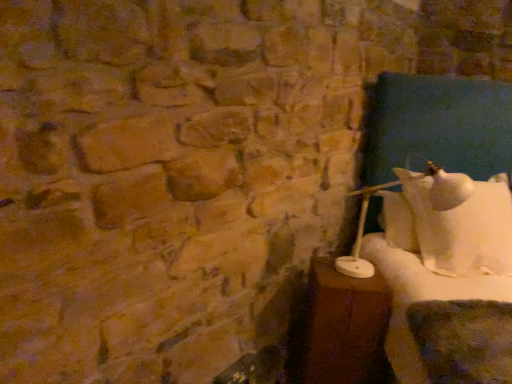
Where is `white matte table lamp at right`? Image resolution: width=512 pixels, height=384 pixels. white matte table lamp at right is located at coordinates (366, 216).

The width and height of the screenshot is (512, 384). What do you see at coordinates (366, 216) in the screenshot?
I see `white matte table lamp at right` at bounding box center [366, 216].

What do you see at coordinates (344, 327) in the screenshot? I see `brown wooden table at right` at bounding box center [344, 327].

You are a GUI agent. You are given a task and a screenshot of the screen. Output one action in this format:
    pyautogui.click(x=<x>, y=<y>)
    Task: Click on the brown wooden table at right
    The height and width of the screenshot is (384, 512).
    Given the screenshot: What is the action you would take?
    pyautogui.click(x=344, y=327)

What is the approximate height of brown wooden table at right?

26.47 inches.

Measure the distance between brown wooden table at right and camera.

They are 6.09 feet apart.

What are the coordinates of `white matte table lamp at right` in the screenshot? It's located at (366, 216).

Considering the positions of objects white matte table lamp at right and brown wooden table at right in the image provided, who is more to the left, white matte table lamp at right or brown wooden table at right?

Positioned to the left is brown wooden table at right.

Is white matte table lamp at right positioned before brown wooden table at right?

Yes, white matte table lamp at right is in front of brown wooden table at right.

Considering the positions of point (364, 262) and point (355, 333), is point (364, 262) closer or farther from the camera than point (355, 333)?

Point (364, 262).

From the image's perspective, is white matte table lamp at right below brown wooden table at right?

No, from the image's perspective, white matte table lamp at right is not beneath brown wooden table at right.

From a real-world perspective, who is located higher, white matte table lamp at right or brown wooden table at right?

white matte table lamp at right.

Considering the sizes of objects white matte table lamp at right and brown wooden table at right in the image provided, who is wider, white matte table lamp at right or brown wooden table at right?

Wider between the two is white matte table lamp at right.

Is white matte table lamp at right taller than brown wooden table at right?

No, white matte table lamp at right is not taller than brown wooden table at right.

Considering the relative sizes of white matte table lamp at right and brown wooden table at right in the image provided, is white matte table lamp at right bigger than brown wooden table at right?

Yes, white matte table lamp at right is bigger than brown wooden table at right.

Can we say white matte table lamp at right lies outside brown wooden table at right?

Yes, white matte table lamp at right is located beyond the bounds of brown wooden table at right.

Are white matte table lamp at right and brown wooden table at right making contact?

No.

Could you tell me if white matte table lamp at right is turned towards brown wooden table at right?

No, white matte table lamp at right does not turn towards brown wooden table at right.

How many degrees apart are the facing directions of white matte table lamp at right and brown wooden table at right?

The facing directions of white matte table lamp at right and brown wooden table at right are 52.4 degrees apart.

The image size is (512, 384). In order to click on furniture that is under the white matte table lamp at right (from a real-world perspective) in this screenshot , I will do `click(344, 327)`.

Considering the relative positions of brown wooden table at right and white matte table lamp at right in the image provided, is brown wooden table at right to the left of white matte table lamp at right from the viewer's perspective?

Yes.

Relative to white matte table lamp at right, is brown wooden table at right in front or behind?

In the image, brown wooden table at right appears behind white matte table lamp at right.

Is point (306, 316) behind point (341, 265)?

Yes, point (306, 316) is behind point (341, 265).

From the image's perspective, which one is positioned lower, brown wooden table at right or white matte table lamp at right?

brown wooden table at right.

From a real-world perspective, who is located lower, brown wooden table at right or white matte table lamp at right?

brown wooden table at right is physically lower.

Between brown wooden table at right and white matte table lamp at right, which one has larger width?

With larger width is white matte table lamp at right.

From the picture: Who is taller, brown wooden table at right or white matte table lamp at right?

Standing taller between the two is brown wooden table at right.

Can you confirm if brown wooden table at right is smaller than white matte table lamp at right?

Indeed, brown wooden table at right has a smaller size compared to white matte table lamp at right.

Could white matte table lamp at right be considered to be inside brown wooden table at right?

No.

Would you say brown wooden table at right is a long distance from white matte table lamp at right?

No, there isn't a large distance between brown wooden table at right and white matte table lamp at right.

Is brown wooden table at right turned away from white matte table lamp at right?

That's not correct — brown wooden table at right is not looking away from white matte table lamp at right.

Where is `furniture below the white matte table lamp at right (from the image's perspective)`? This screenshot has height=384, width=512. furniture below the white matte table lamp at right (from the image's perspective) is located at coordinates (344, 327).

Locate an element on the screen. The image size is (512, 384). furniture on the left of white matte table lamp at right is located at coordinates (344, 327).

Where is `table lamp on the right of the brown wooden table at right`? table lamp on the right of the brown wooden table at right is located at coordinates (366, 216).